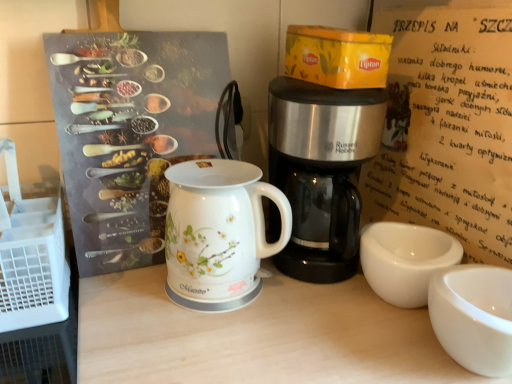
Question: Visually, is white glossy electric kettle at center positioned to the left or to the right of white glossy cup at lower right?

Choices:
 (A) left
 (B) right

Answer: (A)

Question: Looking at the image, does white glossy electric kettle at center seem bigger or smaller compared to white glossy cup at lower right?

Choices:
 (A) big
 (B) small

Answer: (A)

Question: Considering the real-world distances, which object is closest to the white glossy cup at lower right?

Choices:
 (A) white plastic crate at left
 (B) white paper at upper right
 (C) white glossy electric kettle at center
 (D) stainless steel coffee maker at center

Answer: (B)

Question: Estimate the real-world distances between objects in this image. Which object is closer to the stainless steel coffee maker at center?

Choices:
 (A) white glossy cup at lower right
 (B) white plastic crate at left
 (C) white paper at upper right
 (D) white glossy electric kettle at center

Answer: (D)